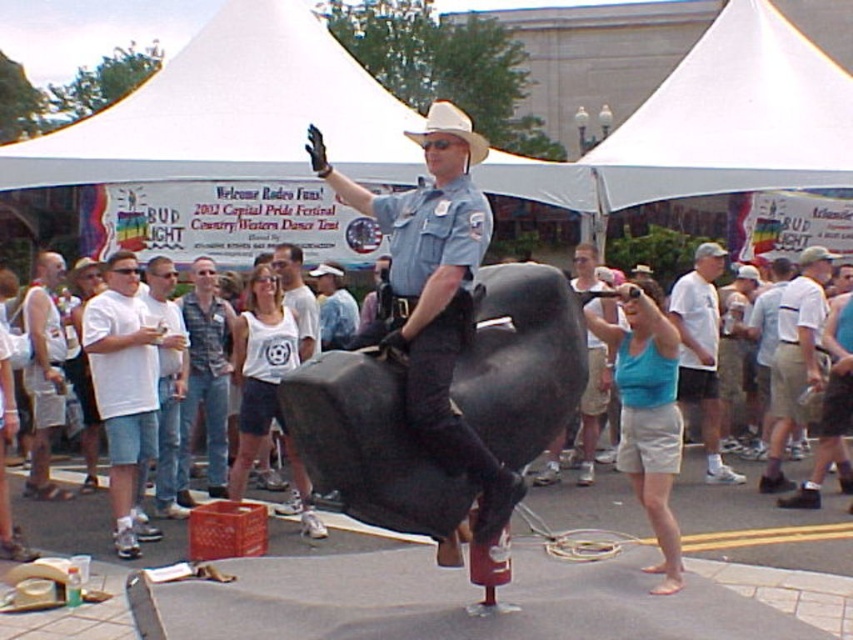
Is white cotton tank top at center positioned before white cotton t-shirt at left?

That is True.

Does white cotton tank top at center have a lesser width compared to white cotton t-shirt at left?

No.

Find the location of a particular element. The height and width of the screenshot is (640, 853). white cotton tank top at center is located at coordinates pyautogui.click(x=523, y=362).

I want to click on white cotton t-shirt at left, so click(125, 390).

You are a GUI agent. You are given a task and a screenshot of the screen. Output one action in this format:
    pyautogui.click(x=<x>, y=<y>)
    Task: Click on the white cotton t-shirt at left
    The image size is (853, 640).
    Given the screenshot: What is the action you would take?
    pyautogui.click(x=125, y=390)

Is point (114, 358) positioned before point (183, 481)?

Yes, it is in front of point (183, 481).

Does point (108, 376) come behind point (219, 324)?

No, it is in front of (219, 324).

Locate an element on the screen. white cotton t-shirt at left is located at coordinates (125, 390).

Find the location of `white cotton t-shirt at left`. white cotton t-shirt at left is located at coordinates (125, 390).